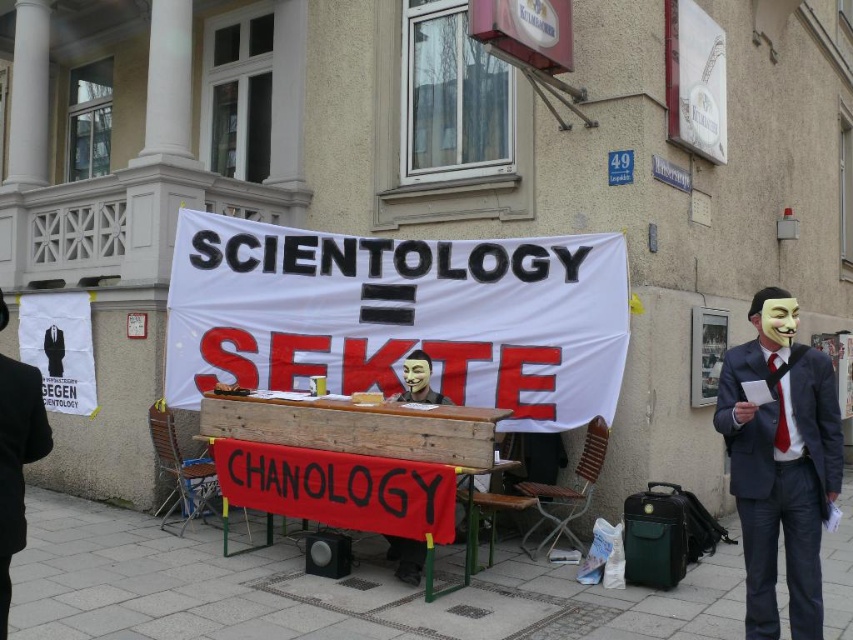
Between matte black suit at right and black suit at center, which one appears on the left side from the viewer's perspective?

black suit at center

Consider the image. How far apart are matte black suit at right and black suit at center?

matte black suit at right and black suit at center are 3.30 meters apart from each other.

Is point (810, 372) closer to viewer compared to point (22, 497)?

That is False.

Locate an element on the screen. The image size is (853, 640). matte black suit at right is located at coordinates (780, 464).